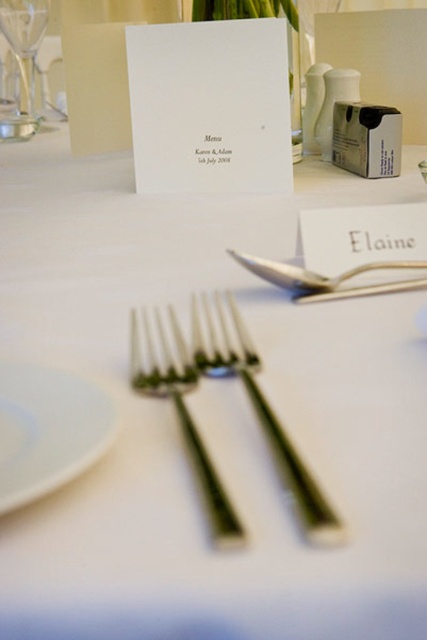
Question: Which object is positioned farthest from the white glossy plate at lower left?

Choices:
 (A) clear glass wine glass at upper left
 (B) silver metallic fork at center
 (C) silver metallic knife at upper center
 (D) polished silver fork at center

Answer: (A)

Question: Is polished silver fork at center smaller than silver metallic knife at upper center?

Choices:
 (A) no
 (B) yes

Answer: (A)

Question: Does white glossy plate at lower left come in front of silver metallic fork at center?

Choices:
 (A) yes
 (B) no

Answer: (B)

Question: Which of the following is the farthest from the observer?

Choices:
 (A) (290, 266)
 (B) (14, 120)
 (C) (190, 451)

Answer: (B)

Question: Which is farther from the clear glass wine glass at upper left?

Choices:
 (A) silver metallic fork at center
 (B) white glossy plate at lower left
 (C) silver metallic knife at upper center

Answer: (B)

Question: Does white glossy plate at lower left come in front of silver metallic fork at center?

Choices:
 (A) yes
 (B) no

Answer: (B)